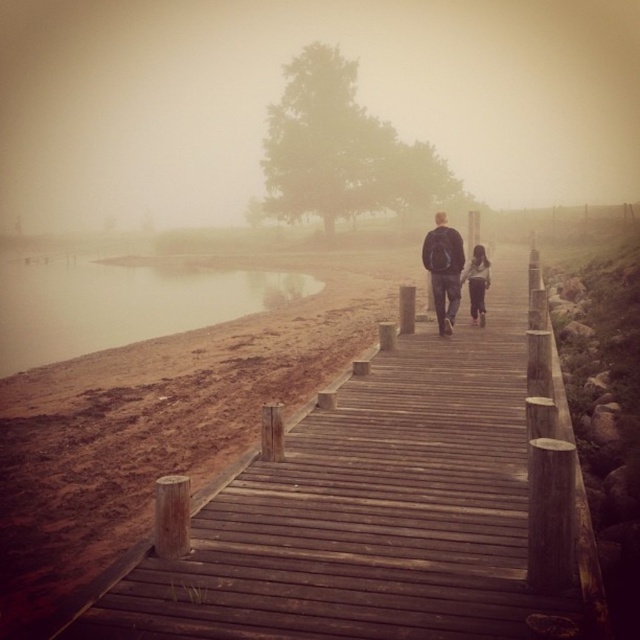
What do you see at coordinates (387, 509) in the screenshot? I see `wooden dock at center` at bounding box center [387, 509].

Is point (253, 509) behind point (454, 240)?

No, it is in front of (454, 240).

Who is more distant from viewer, (324, 627) or (460, 275)?

Positioned behind is point (460, 275).

Where is `wooden dock at center`? The width and height of the screenshot is (640, 640). wooden dock at center is located at coordinates (387, 509).

Is dark brown leather jacket at center to the right of light gray sweater at center from the viewer's perspective?

In fact, dark brown leather jacket at center is to the left of light gray sweater at center.

Does dark brown leather jacket at center appear under light gray sweater at center?

Actually, dark brown leather jacket at center is above light gray sweater at center.

Who is more forward, (428,248) or (480,308)?

Positioned in front is point (428,248).

Locate an element on the screen. dark brown leather jacket at center is located at coordinates (444, 269).

Measure the distance between wooden dock at center and brown dirt at lower left.

They are 76.81 feet apart.

Is point (275, 582) behind point (170, 317)?

No, it is in front of (170, 317).

Locate an element on the screen. wooden dock at center is located at coordinates point(387,509).